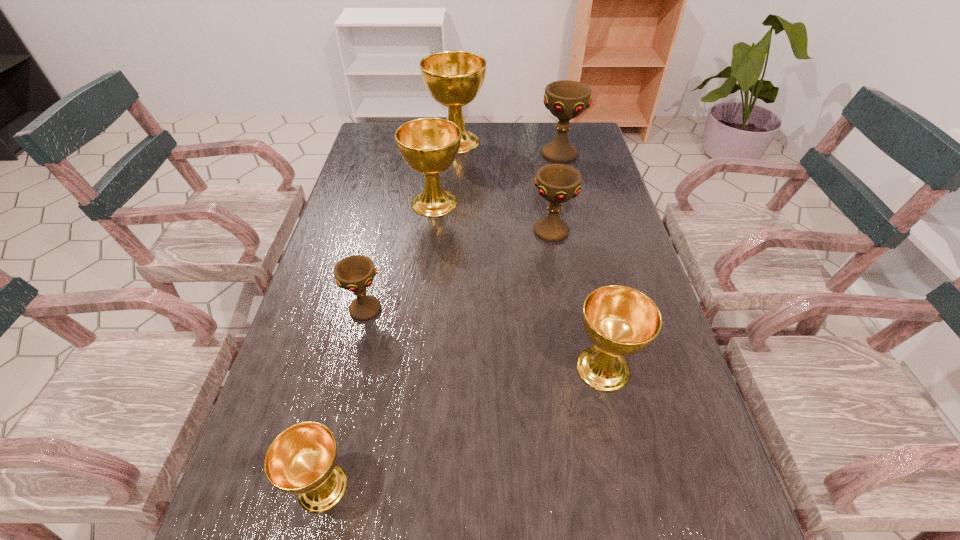
Locate an element on the screen. This screenshot has height=540, width=960. the biggest gold chalice is located at coordinates (453, 79).

Where is `the farthest gold chalice`? the farthest gold chalice is located at coordinates (453, 79).

Where is `the farthest red chalice`? The height and width of the screenshot is (540, 960). the farthest red chalice is located at coordinates (566, 99).

The image size is (960, 540). What are the coordinates of `the second biggest gold chalice` in the screenshot? It's located at (429, 146).

The width and height of the screenshot is (960, 540). Find the location of `the second nearest red chalice`. the second nearest red chalice is located at coordinates (557, 183).

Identify the location of the second nearest object. This screenshot has height=540, width=960. (620, 321).

What are the coordinates of `the rightmost gold chalice` in the screenshot? It's located at (620, 321).

Image resolution: width=960 pixels, height=540 pixels. I want to click on the nearest red chalice, so click(x=355, y=273).

I want to click on the third nearest object, so click(355, 273).

Locate an element on the screen. The image size is (960, 540). the nearest gold chalice is located at coordinates (301, 460).